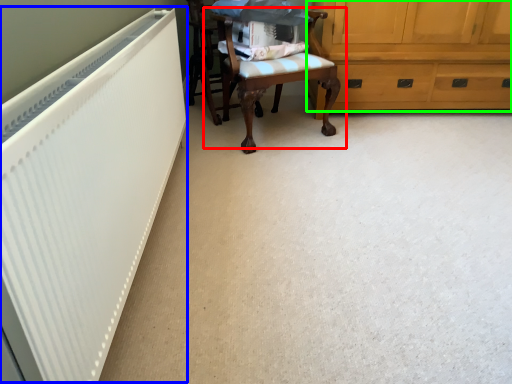
Question: Which object is the farthest from chair (highlighted by a red box)? Choose among these: radiator (highlighted by a blue box) or cabinetry (highlighted by a green box).

Choices:
 (A) radiator
 (B) cabinetry

Answer: (A)